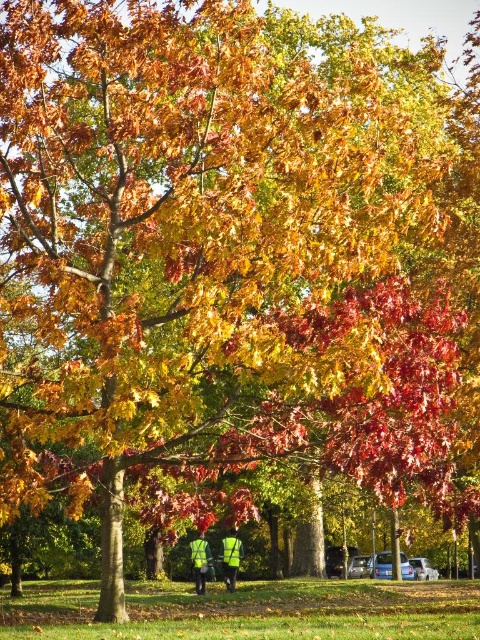
Is high-visibility reflective vest at center taller than high-visibility fabric person at center?

Correct, high-visibility reflective vest at center is much taller as high-visibility fabric person at center.

Which is behind, point (196, 582) or point (228, 572)?

Point (228, 572)

You are a GUI agent. You are given a task and a screenshot of the screen. Output one action in this format:
    pyautogui.click(x=<x>, y=<y>)
    Task: Click on the high-visibility reflective vest at center
    The image size is (480, 640).
    Given the screenshot: What is the action you would take?
    pyautogui.click(x=201, y=561)